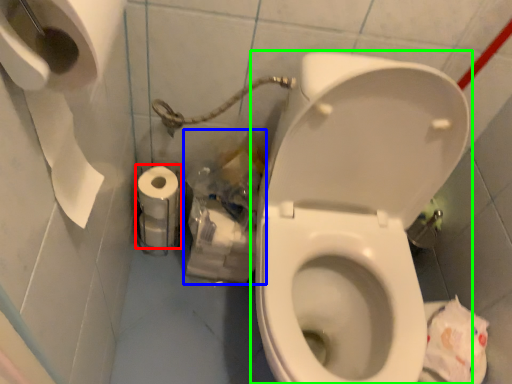
Question: Which object is positioned farthest from toilet paper (highlighted by a red box)? Select from garbage (highlighted by a blue box) and toilet (highlighted by a green box).

Choices:
 (A) garbage
 (B) toilet

Answer: (B)